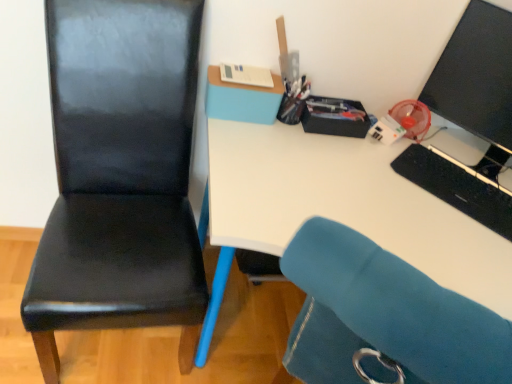
Question: Should I look upward or downward to see black matte keyboard at right?

Choices:
 (A) up
 (B) down

Answer: (A)

Question: Can you confirm if black glossy monitor at upper right is bigger than white paper at upper center, the 1th stationery viewed from the left?

Choices:
 (A) no
 (B) yes

Answer: (B)

Question: Does black glossy monitor at upper right touch white paper at upper center, the 3th stationery from the right?

Choices:
 (A) no
 (B) yes

Answer: (A)

Question: From the image's perspective, is black glossy monitor at upper right on white paper at upper center, the 3th stationery from the right?

Choices:
 (A) no
 (B) yes

Answer: (A)

Question: Is white paper at upper center, the 3th stationery from the right, located within black glossy monitor at upper right?

Choices:
 (A) no
 (B) yes

Answer: (A)

Question: Is black glossy monitor at upper right positioned with its back to white paper at upper center, the 1th stationery viewed from the left?

Choices:
 (A) yes
 (B) no

Answer: (B)

Question: Considering the relative sizes of black glossy monitor at upper right and white paper at upper center, the 3th stationery from the right, in the image provided, is black glossy monitor at upper right thinner than white paper at upper center, the 3th stationery from the right,?

Choices:
 (A) yes
 (B) no

Answer: (B)

Question: Does black leather chair at left come in front of white paper at upper center, the 1th stationery viewed from the left?

Choices:
 (A) yes
 (B) no

Answer: (A)

Question: Is black leather chair at left facing towards white paper at upper center, the 1th stationery viewed from the left?

Choices:
 (A) no
 (B) yes

Answer: (A)

Question: Can you confirm if black leather chair at left is bigger than white paper at upper center, the 1th stationery viewed from the left?

Choices:
 (A) yes
 (B) no

Answer: (A)

Question: Is white paper at upper center, the 1th stationery viewed from the left, completely or partially inside black leather chair at left?

Choices:
 (A) no
 (B) yes

Answer: (A)

Question: Considering the relative sizes of black leather chair at left and white paper at upper center, the 3th stationery from the right, in the image provided, is black leather chair at left thinner than white paper at upper center, the 3th stationery from the right,?

Choices:
 (A) yes
 (B) no

Answer: (B)

Question: From a real-world perspective, is black leather chair at left under white paper at upper center, the 1th stationery viewed from the left?

Choices:
 (A) yes
 (B) no

Answer: (A)

Question: From a real-world perspective, is black glossy monitor at upper right beneath metallic pen holder at upper center, acting as the 2th stationery starting from the right?

Choices:
 (A) yes
 (B) no

Answer: (B)